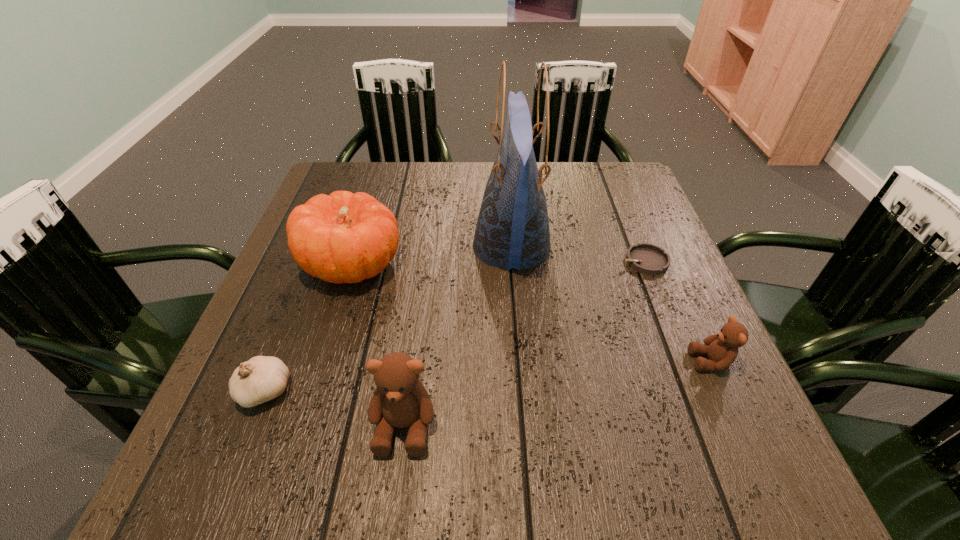
The width and height of the screenshot is (960, 540). What are the coordinates of `the left teddy bear` in the screenshot? It's located at (400, 400).

This screenshot has height=540, width=960. I want to click on the taller teddy bear, so click(x=400, y=400).

Image resolution: width=960 pixels, height=540 pixels. I want to click on the right teddy bear, so click(722, 349).

The image size is (960, 540). What are the coordinates of `the shorter teddy bear` in the screenshot? It's located at (722, 349).

The image size is (960, 540). In order to click on shopping bag in this screenshot , I will do click(512, 231).

You are a GUI agent. You are given a task and a screenshot of the screen. Output one action in this format:
    pyautogui.click(x=<x>, y=<y>)
    Task: Click on the third object from right to left
    
    Given the screenshot: What is the action you would take?
    pyautogui.click(x=512, y=231)

You are a GUI agent. You are given a task and a screenshot of the screen. Output one action in this format:
    pyautogui.click(x=<x>, y=<y>)
    Task: Click on the shortest object
    This screenshot has height=540, width=960.
    Given the screenshot: What is the action you would take?
    pyautogui.click(x=648, y=259)

Find the location of a particular element. Image resolution: width=960 pixels, height=540 pixels. pumpkin is located at coordinates pos(342,238).

Find the location of a particular element. The image size is (960, 540). garlic is located at coordinates (262, 378).

Where is `vacant space positioned 0.140m on the face of the farther teddy bear`? Image resolution: width=960 pixels, height=540 pixels. vacant space positioned 0.140m on the face of the farther teddy bear is located at coordinates point(614,361).